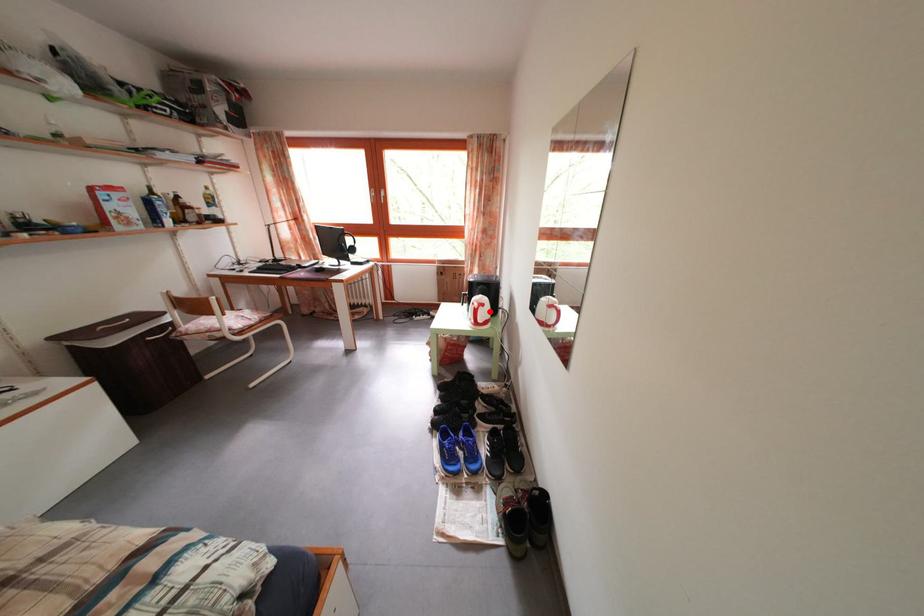
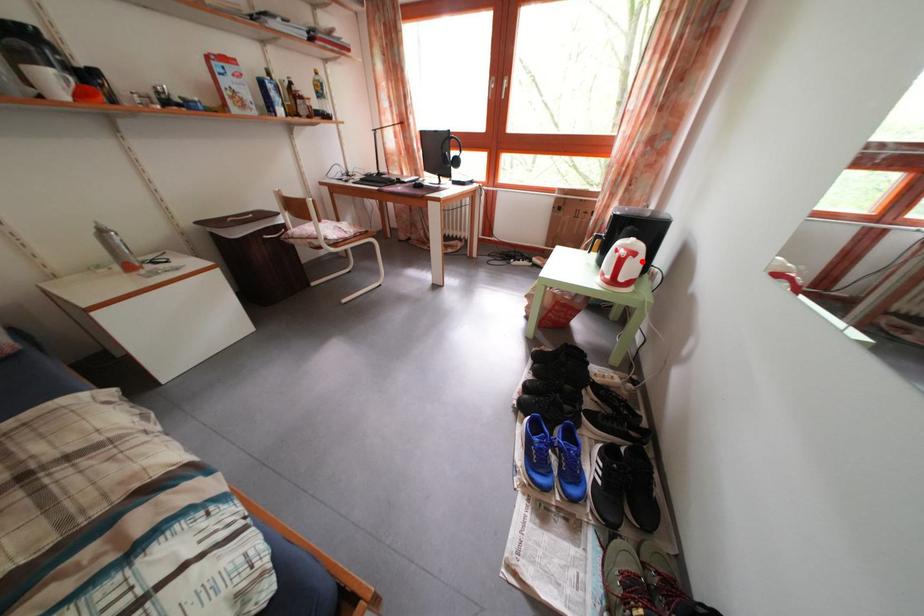
I am providing you with two images of the same scene from different viewpoints. A red point is marked on the first image and another point is marked on the second image. Do the highlighted points in image1 and image2 indicate the same real-world spot?

Yes